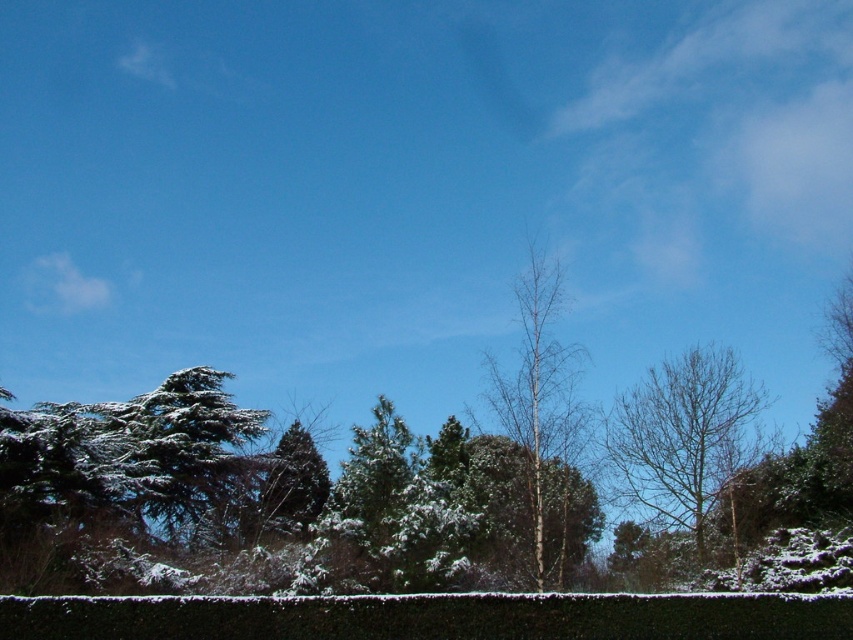
Can you confirm if bare branches tree at center is bigger than bare wood tree at center?

No, bare branches tree at center is not bigger than bare wood tree at center.

Who is lower down, bare branches tree at center or bare wood tree at center?

Positioned lower is bare branches tree at center.

What do you see at coordinates (683, 436) in the screenshot? I see `bare branches tree at center` at bounding box center [683, 436].

Where is `bare branches tree at center`? The height and width of the screenshot is (640, 853). bare branches tree at center is located at coordinates (683, 436).